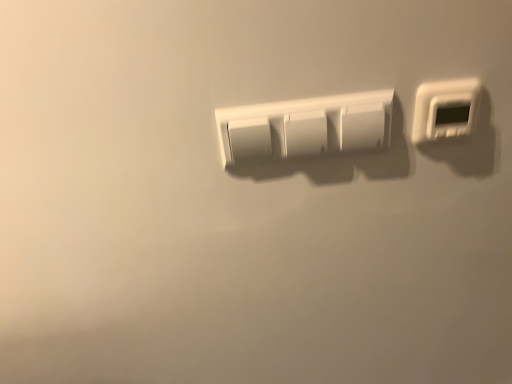
Question: Considering the relative sizes of white plastic thermostat at upper right, arranged as the second light switch when viewed from the left, and white matte light switch at center, the 2th light switch when ordered from right to left, in the image provided, is white plastic thermostat at upper right, arranged as the second light switch when viewed from the left, smaller than white matte light switch at center, the 2th light switch when ordered from right to left,?

Choices:
 (A) no
 (B) yes

Answer: (B)

Question: Does white plastic thermostat at upper right, arranged as the second light switch when viewed from the left, have a lesser width compared to white matte light switch at center, the first light switch in the left-to-right sequence?

Choices:
 (A) yes
 (B) no

Answer: (B)

Question: Is white plastic thermostat at upper right, positioned as the first light switch in right-to-left order, looking in the opposite direction of white matte light switch at center, the 2th light switch when ordered from right to left?

Choices:
 (A) no
 (B) yes

Answer: (A)

Question: From the image's perspective, is white plastic thermostat at upper right, positioned as the first light switch in right-to-left order, on top of white matte light switch at center, the 2th light switch when ordered from right to left?

Choices:
 (A) yes
 (B) no

Answer: (A)

Question: From the image's perspective, is white plastic thermostat at upper right, arranged as the second light switch when viewed from the left, below white matte light switch at center, the 2th light switch when ordered from right to left?

Choices:
 (A) no
 (B) yes

Answer: (A)

Question: Can you confirm if white plastic thermostat at upper right, positioned as the first light switch in right-to-left order, is bigger than white matte light switch at center, the 2th light switch when ordered from right to left?

Choices:
 (A) no
 (B) yes

Answer: (A)

Question: Is white matte light switch at center, the first light switch in the left-to-right sequence, at the right side of white plastic thermostat at upper right, arranged as the second light switch when viewed from the left?

Choices:
 (A) yes
 (B) no

Answer: (B)

Question: Is white matte light switch at center, the 2th light switch when ordered from right to left, not within white plastic thermostat at upper right, positioned as the first light switch in right-to-left order?

Choices:
 (A) no
 (B) yes

Answer: (B)

Question: Is white matte light switch at center, the first light switch in the left-to-right sequence, shorter than white plastic thermostat at upper right, arranged as the second light switch when viewed from the left?

Choices:
 (A) no
 (B) yes

Answer: (A)

Question: From a real-world perspective, is white matte light switch at center, the first light switch in the left-to-right sequence, physically above white plastic thermostat at upper right, arranged as the second light switch when viewed from the left?

Choices:
 (A) yes
 (B) no

Answer: (B)

Question: Is white matte light switch at center, the first light switch in the left-to-right sequence, oriented towards white plastic thermostat at upper right, arranged as the second light switch when viewed from the left?

Choices:
 (A) yes
 (B) no

Answer: (B)

Question: Does white matte light switch at center, the first light switch in the left-to-right sequence, touch white plastic thermostat at upper right, arranged as the second light switch when viewed from the left?

Choices:
 (A) yes
 (B) no

Answer: (B)

Question: In terms of width, does white plastic thermostat at upper right, arranged as the second light switch when viewed from the left, look wider or thinner when compared to white matte light switch at center, the 2th light switch when ordered from right to left?

Choices:
 (A) thin
 (B) wide

Answer: (B)